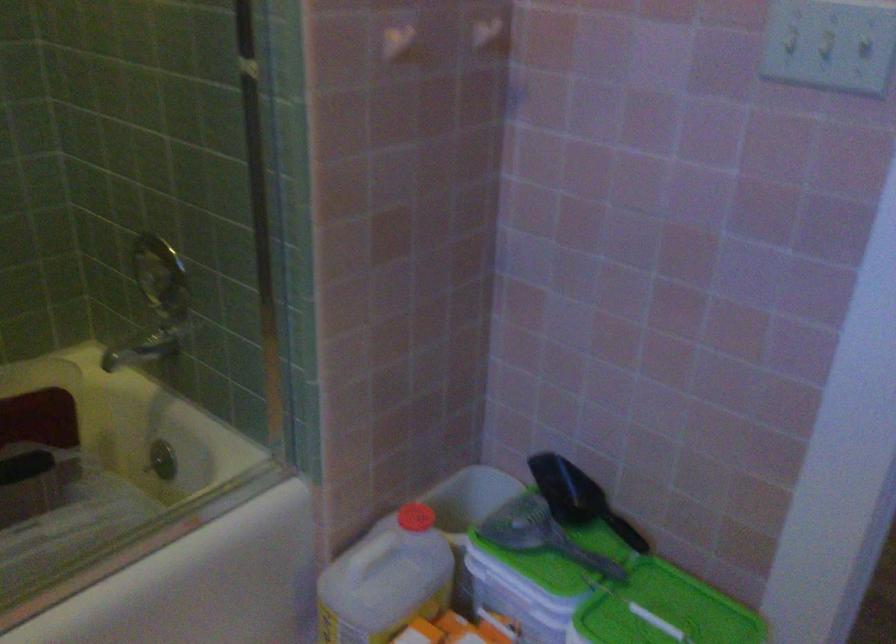
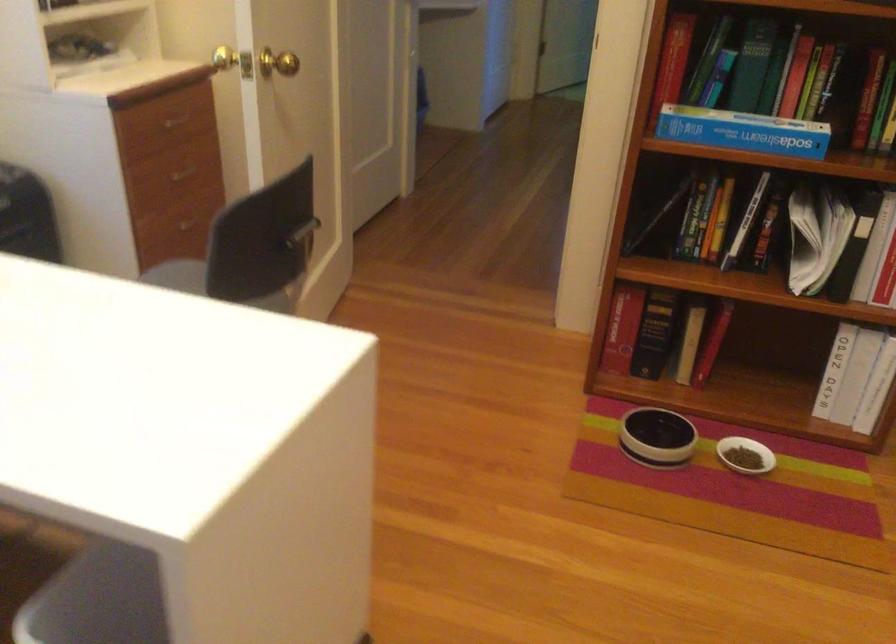
Question: I am providing you with two images of the same scene from different viewpoints. Please identify which objects are invisible in image2.

Choices:
 (A) chair back handle
 (B) brass door knob
 (C) pink cup
 (D) white plastic jug

Answer: (D)